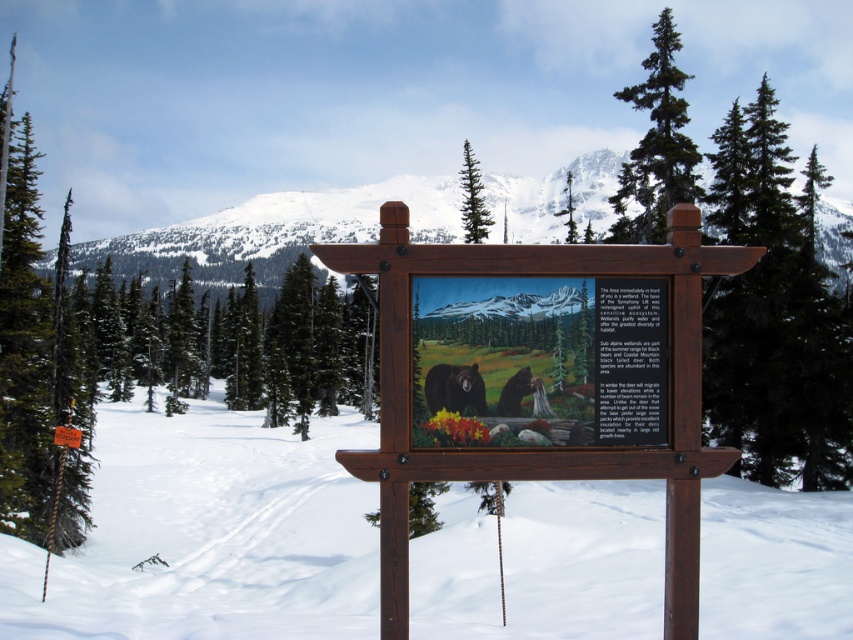
At what (x,y) coordinates should I click in order to perform the action: click on green evergreen tree at right. Please return your answer as a coordinate pair (x, y). This screenshot has height=640, width=853. Looking at the image, I should click on tap(775, 314).

Does green evergreen tree at right have a smaller size compared to green coniferous tree at center?

Incorrect, green evergreen tree at right is not smaller in size than green coniferous tree at center.

Identify the location of green evergreen tree at right. (775, 314).

The width and height of the screenshot is (853, 640). Identify the location of green evergreen tree at right. (775, 314).

Which of these two, snowy white mountain at upper center or green coniferous tree at upper center, stands taller?

With more height is snowy white mountain at upper center.

What do you see at coordinates (276, 230) in the screenshot? I see `snowy white mountain at upper center` at bounding box center [276, 230].

You are a GUI agent. You are given a task and a screenshot of the screen. Output one action in this format:
    pyautogui.click(x=<x>, y=<y>)
    Task: Click on the snowy white mountain at upper center
    Image resolution: width=853 pixels, height=640 pixels.
    Given the screenshot: What is the action you would take?
    pyautogui.click(x=276, y=230)

Does point (428, 305) come in front of point (473, 193)?

Yes, it is.

Which of these two, wooden sign at center or green coniferous tree at upper center, stands taller?

With more height is green coniferous tree at upper center.

You are a GUI agent. You are given a task and a screenshot of the screen. Output one action in this format:
    pyautogui.click(x=<x>, y=<y>)
    Task: Click on the wooden sign at center
    
    Given the screenshot: What is the action you would take?
    pyautogui.click(x=540, y=376)

Image resolution: width=853 pixels, height=640 pixels. I want to click on wooden sign at center, so click(x=540, y=376).